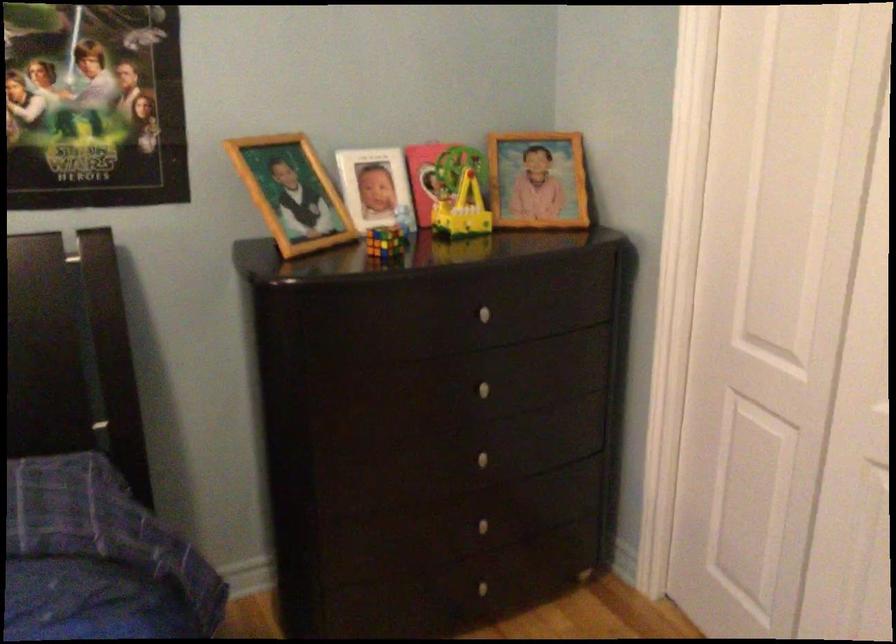
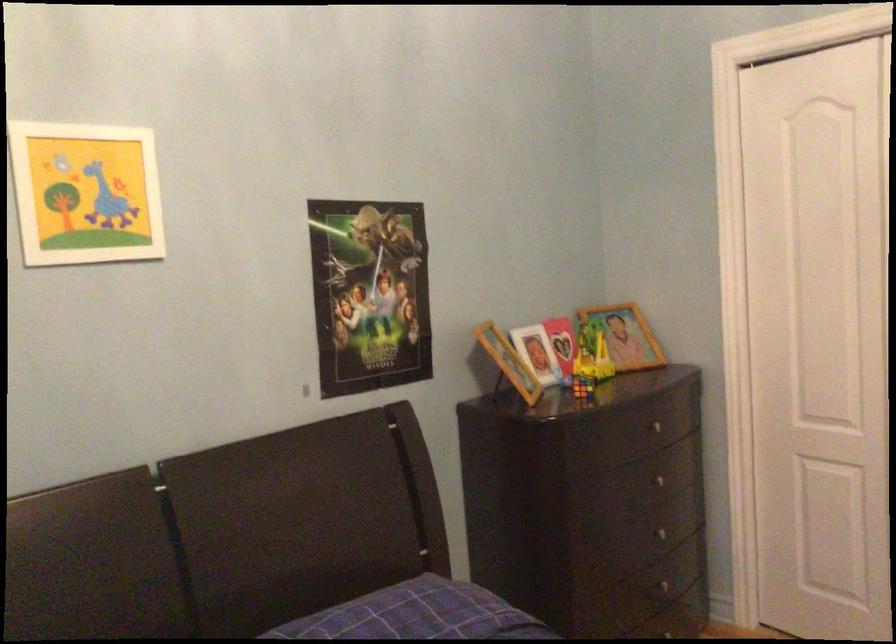
Where in the second image is the point corresponding to the point at 483,451 from the first image?

(667, 532)